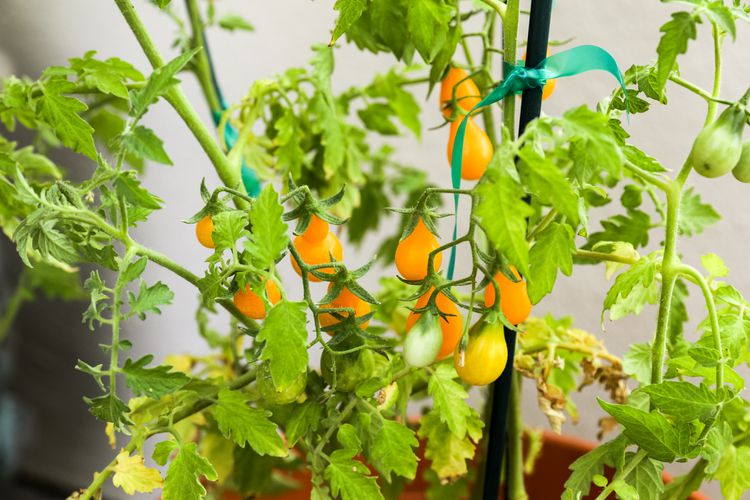
Identify the location of white wall. The image size is (750, 500). (619, 21).